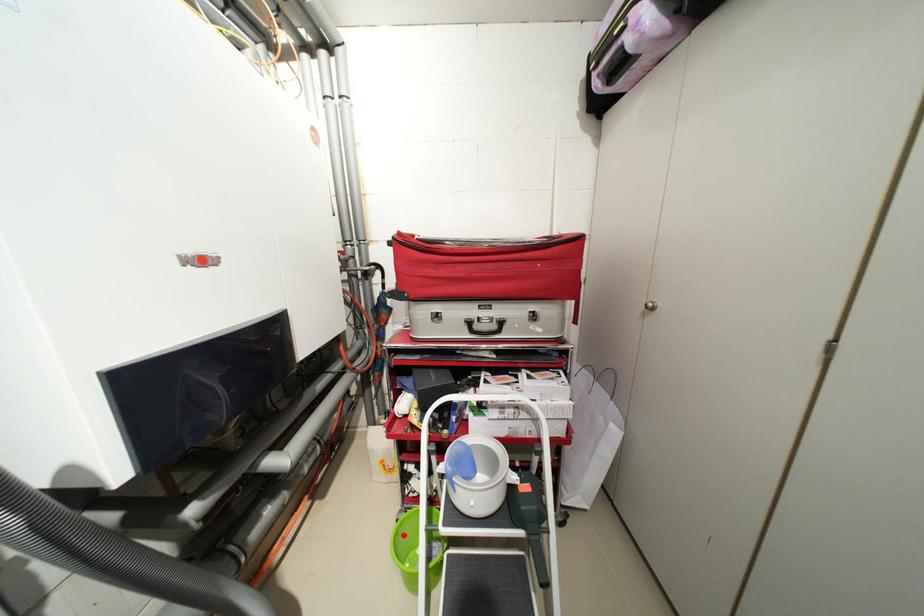
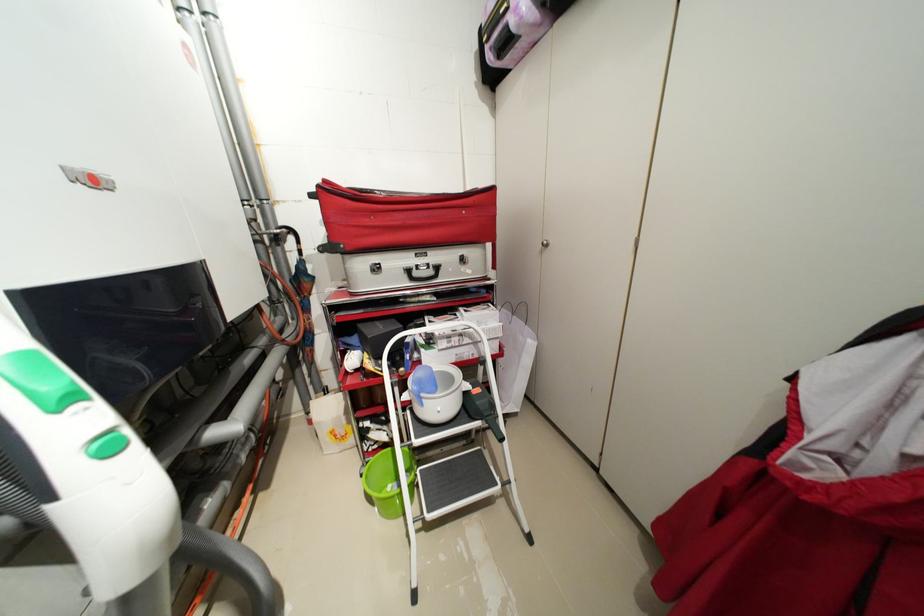
Question: I am providing you with two images of the same scene from different viewpoints. A red point is shown in image1. For the corresponding object point in image2, is it positioned nearer or farther from the camera?

Choices:
 (A) Nearer
 (B) Farther

Answer: (B)